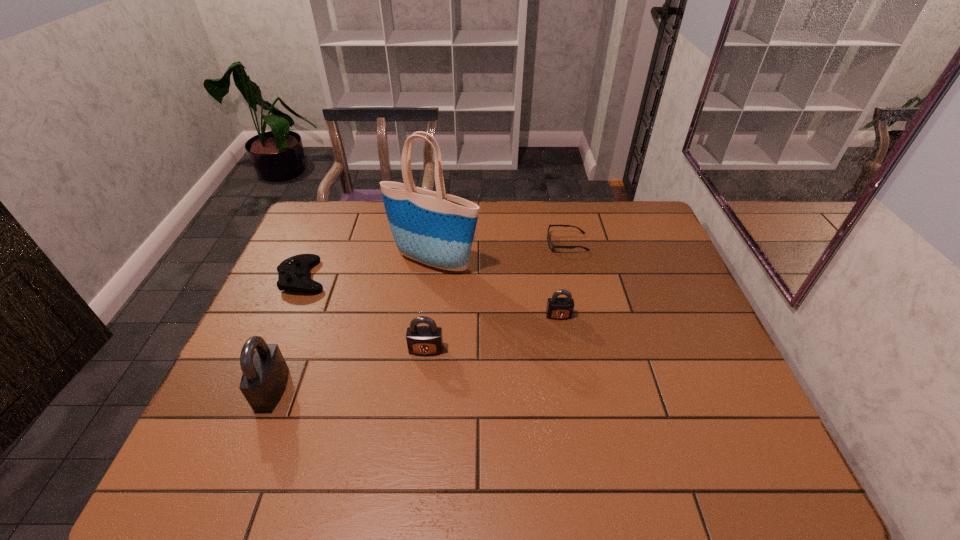
The height and width of the screenshot is (540, 960). Find the location of `free spot between the control and the rightmost padlock`. free spot between the control and the rightmost padlock is located at coordinates (431, 296).

The height and width of the screenshot is (540, 960). Find the location of `free space between the tallest object and the second farthest padlock`. free space between the tallest object and the second farthest padlock is located at coordinates click(430, 306).

At what (x,y) coordinates should I click in order to perform the action: click on empty space that is in between the sunglasses and the farthest padlock. Please return your answer as a coordinate pair (x, y). The height and width of the screenshot is (540, 960). Looking at the image, I should click on (563, 279).

This screenshot has height=540, width=960. What are the coordinates of `free spot between the second nearest object and the farthest padlock` in the screenshot? It's located at (492, 333).

Where is `vacant point located between the leftmost padlock and the tallest object`? The height and width of the screenshot is (540, 960). vacant point located between the leftmost padlock and the tallest object is located at coordinates (353, 326).

The width and height of the screenshot is (960, 540). What are the coordinates of `object identified as the third closest to the rightmost padlock` in the screenshot? It's located at (421, 340).

Identify which object is located as the second nearest to the nearest padlock. Please provide its 2D coordinates. Your answer should be formatted as a tuple, i.e. [(x, y)], where the tuple contains the x and y coordinates of a point satisfying the conditions above.

[(421, 340)]

Locate which padlock ranks in proximity to the sunglasses. Please provide its 2D coordinates. Your answer should be formatted as a tuple, i.e. [(x, y)], where the tuple contains the x and y coordinates of a point satisfying the conditions above.

[(558, 308)]

Locate which padlock ranks in proximity to the shortest object. Please provide its 2D coordinates. Your answer should be formatted as a tuple, i.e. [(x, y)], where the tuple contains the x and y coordinates of a point satisfying the conditions above.

[(558, 308)]

Image resolution: width=960 pixels, height=540 pixels. What are the coordinates of `free space that satisfies the following two spatial constraints: 1. on the front-facing side of the shortest object; 2. on the front side of the fifth tallest object` in the screenshot? It's located at (575, 277).